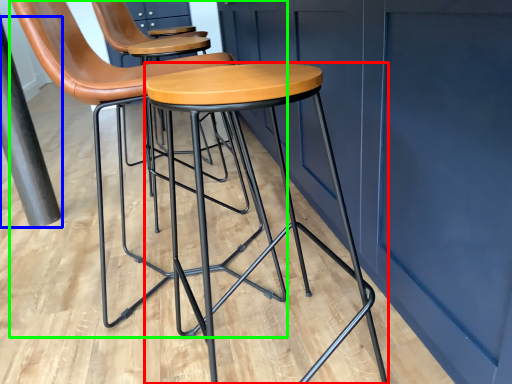
Question: Which object is the farthest from stool (highlighted by a red box)? Choose among these: pole (highlighted by a blue box) or chair (highlighted by a green box).

Choices:
 (A) pole
 (B) chair

Answer: (A)